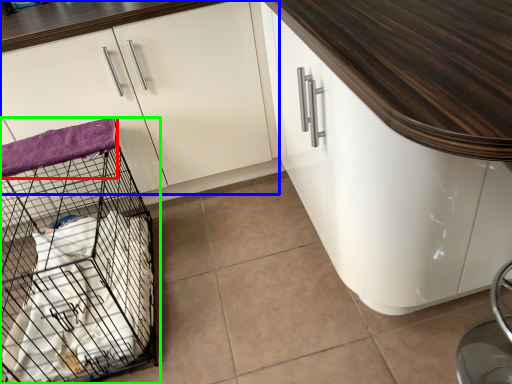
Question: Considering the real-world distances, which object is closest to blanket (highlighted by a red box)? cabinetry (highlighted by a blue box) or bird cage (highlighted by a green box).

Choices:
 (A) cabinetry
 (B) bird cage

Answer: (A)